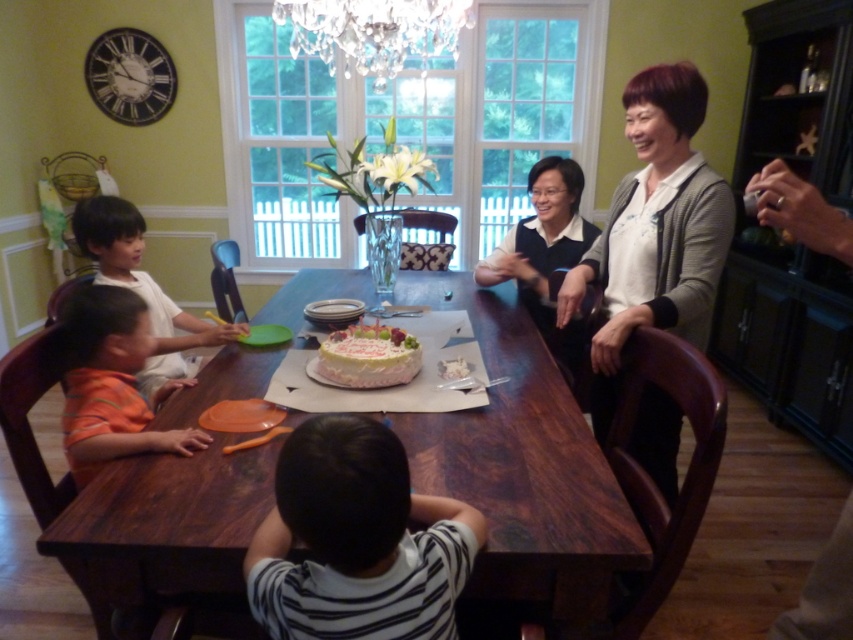
Question: Is white knit sweater at upper right to the right of smooth skin child at left from the viewer's perspective?

Choices:
 (A) yes
 (B) no

Answer: (A)

Question: Among these objects, which one is nearest to the camera?

Choices:
 (A) orange cotton shirt at lower left
 (B) wooden table at center
 (C) white knit sweater at upper right

Answer: (B)

Question: Which of the following is the farthest from the observer?

Choices:
 (A) white knit sweater at upper right
 (B) wooden table at center

Answer: (A)

Question: Where is striped fabric shirt at lower center located in relation to smooth skin child at left in the image?

Choices:
 (A) above
 (B) below

Answer: (B)

Question: Does white knit sweater at upper right appear under smooth skin child at left?

Choices:
 (A) no
 (B) yes

Answer: (A)

Question: Which point is farther to the camera?

Choices:
 (A) (628, 544)
 (B) (84, 214)
 (C) (635, 244)

Answer: (B)